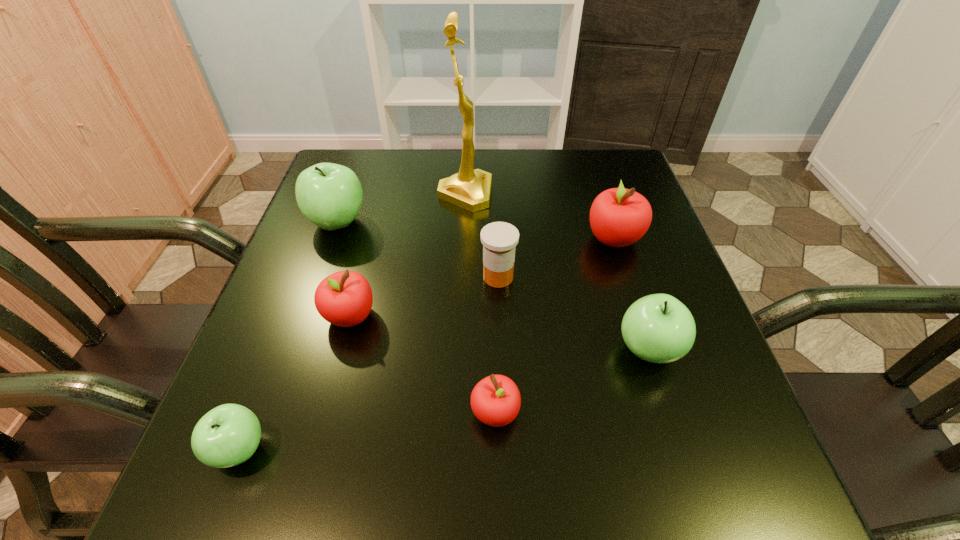
Where is `blank region between the award and the leftmost red apple`? The height and width of the screenshot is (540, 960). blank region between the award and the leftmost red apple is located at coordinates (408, 255).

The image size is (960, 540). What are the coordinates of `vacant space in between the second biggest green apple and the smallest green apple` in the screenshot? It's located at (444, 400).

Choose which object is the fifth nearest neighbor to the biggest green apple. Please provide its 2D coordinates. Your answer should be formatted as a tuple, i.e. [(x, y)], where the tuple contains the x and y coordinates of a point satisfying the conditions above.

[(495, 400)]

The image size is (960, 540). I want to click on object identified as the second closest to the golden award, so click(499, 239).

Find the location of a particular element. This screenshot has width=960, height=540. apple that can be found as the closest to the smallest green apple is located at coordinates (344, 298).

Find the location of a particular element. apple that stands as the fourth closest to the farthest green apple is located at coordinates (619, 217).

Select which red apple is the third closest to the nearest green apple. Please provide its 2D coordinates. Your answer should be formatted as a tuple, i.e. [(x, y)], where the tuple contains the x and y coordinates of a point satisfying the conditions above.

[(619, 217)]

What are the coordinates of `red apple that is the second closest to the rightmost red apple` in the screenshot? It's located at (344, 298).

Identify which green apple is located as the second nearest to the fourth farthest object. Please provide its 2D coordinates. Your answer should be formatted as a tuple, i.e. [(x, y)], where the tuple contains the x and y coordinates of a point satisfying the conditions above.

[(329, 195)]

Select which green apple appears as the second closest to the orange medicine. Please provide its 2D coordinates. Your answer should be formatted as a tuple, i.e. [(x, y)], where the tuple contains the x and y coordinates of a point satisfying the conditions above.

[(329, 195)]